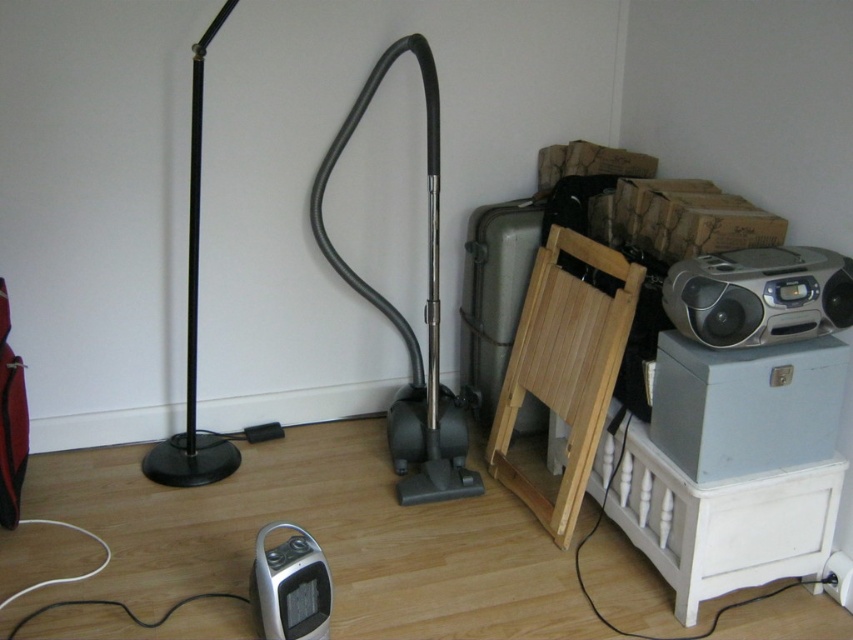
Is point (752, 314) more distant than point (198, 202)?

No, it is not.

Based on the photo, does silver metallic boombox at upper right have a larger size compared to black matte floor lamp at left?

Incorrect, silver metallic boombox at upper right is not larger than black matte floor lamp at left.

What do you see at coordinates (759, 296) in the screenshot? I see `silver metallic boombox at upper right` at bounding box center [759, 296].

Where is `silver metallic boombox at upper right`? silver metallic boombox at upper right is located at coordinates (759, 296).